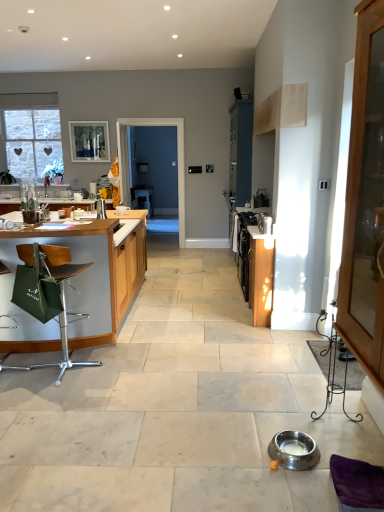
The width and height of the screenshot is (384, 512). I want to click on vacant area that is situated to the right of stainless steel bowl at lower center, acting as the 2th appliance starting from the top, so click(330, 447).